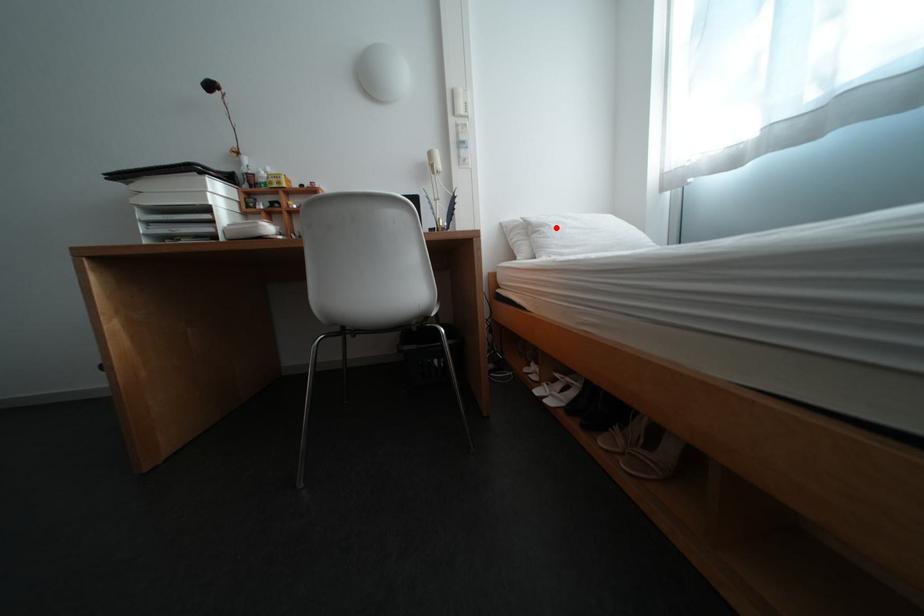
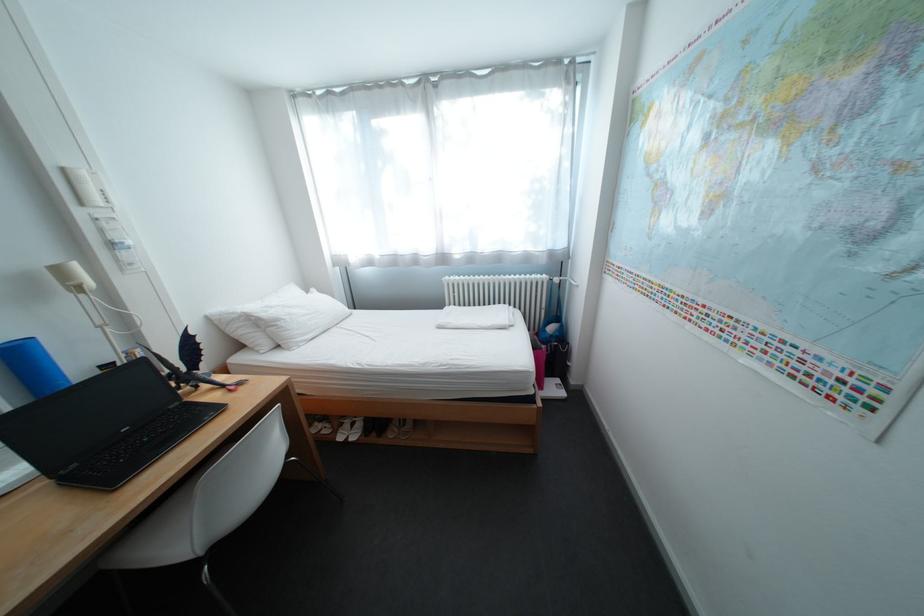
Where in the second image is the point corresponding to the highlighted location from the first image?

(292, 322)